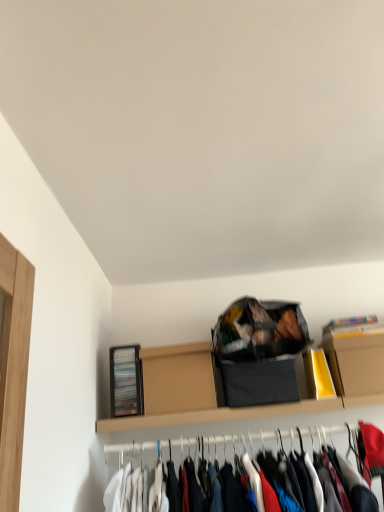
Question: Is the depth of cardboard box at upper right, arranged as the first cardboard box when viewed from the right, greater than that of matte black bag at upper center?

Choices:
 (A) no
 (B) yes

Answer: (B)

Question: Is cardboard box at upper right, arranged as the first cardboard box when viewed from the right, not inside matte black bag at upper center?

Choices:
 (A) yes
 (B) no

Answer: (A)

Question: Is cardboard box at upper right, arranged as the second cardboard box when viewed from the left, touching matte black bag at upper center?

Choices:
 (A) no
 (B) yes

Answer: (A)

Question: From a real-world perspective, is cardboard box at upper right, arranged as the first cardboard box when viewed from the right, positioned over matte black bag at upper center based on gravity?

Choices:
 (A) no
 (B) yes

Answer: (A)

Question: Can you confirm if cardboard box at upper right, arranged as the second cardboard box when viewed from the left, is smaller than matte black bag at upper center?

Choices:
 (A) no
 (B) yes

Answer: (B)

Question: Considering the relative positions of brown cardboard box at upper center, which ranks as the 1th cardboard box in left-to-right order, and cardboard box at upper right, arranged as the second cardboard box when viewed from the left, in the image provided, is brown cardboard box at upper center, which ranks as the 1th cardboard box in left-to-right order, to the left or to the right of cardboard box at upper right, arranged as the second cardboard box when viewed from the left,?

Choices:
 (A) left
 (B) right

Answer: (A)

Question: Is brown cardboard box at upper center, which ranks as the 1th cardboard box in left-to-right order, bigger or smaller than cardboard box at upper right, arranged as the second cardboard box when viewed from the left?

Choices:
 (A) small
 (B) big

Answer: (B)

Question: Is brown cardboard box at upper center, which ranks as the 1th cardboard box in left-to-right order, taller or shorter than cardboard box at upper right, arranged as the first cardboard box when viewed from the right?

Choices:
 (A) short
 (B) tall

Answer: (B)

Question: Considering the positions of point (160, 411) and point (362, 377), is point (160, 411) closer or farther from the camera than point (362, 377)?

Choices:
 (A) farther
 (B) closer

Answer: (A)

Question: From the image's perspective, is cardboard box at upper right, arranged as the first cardboard box when viewed from the right, positioned above or below brown cardboard box at upper center, which appears as the second cardboard box when viewed from the right?

Choices:
 (A) below
 (B) above

Answer: (B)

Question: Considering the positions of cardboard box at upper right, arranged as the first cardboard box when viewed from the right, and brown cardboard box at upper center, which appears as the second cardboard box when viewed from the right, in the image, is cardboard box at upper right, arranged as the first cardboard box when viewed from the right, wider or thinner than brown cardboard box at upper center, which appears as the second cardboard box when viewed from the right,?

Choices:
 (A) thin
 (B) wide

Answer: (A)

Question: Is point (334, 385) closer or farther from the camera than point (168, 396)?

Choices:
 (A) farther
 (B) closer

Answer: (A)

Question: From a real-world perspective, is cardboard box at upper right, arranged as the second cardboard box when viewed from the left, positioned above or below brown cardboard box at upper center, which appears as the second cardboard box when viewed from the right?

Choices:
 (A) above
 (B) below

Answer: (B)

Question: From a real-world perspective, relative to cardboard box at upper right, arranged as the second cardboard box when viewed from the left, is matte black bag at upper center vertically above or below?

Choices:
 (A) below
 (B) above

Answer: (B)

Question: Based on their sizes in the image, would you say matte black bag at upper center is bigger or smaller than cardboard box at upper right, arranged as the second cardboard box when viewed from the left?

Choices:
 (A) small
 (B) big

Answer: (B)